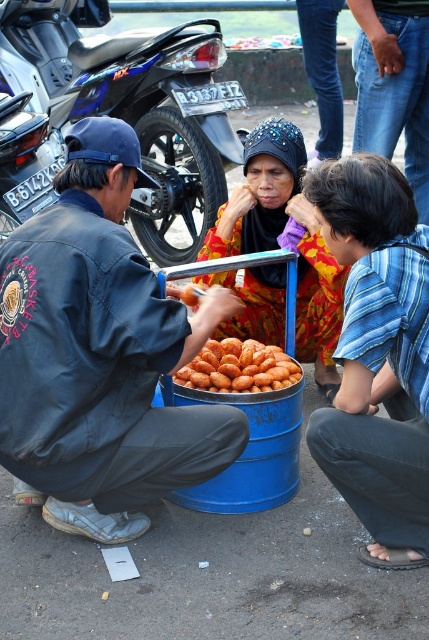
You are a street vendor trying to arrange items in your blue barrel. You have a blue striped shirt at lower right and a golden fried snack at center. Which item takes up more space horizontally?

The golden fried snack at center takes up more horizontal space since its width is greater than the blue striped shirt at lower right.

You are a customer at the street stall and want to order snacks. Which person should you approach first, the matte black jacket at left or the blue striped shirt at lower right, based on their positions?

You should approach the matte black jacket at left first because they are positioned to the left of the blue striped shirt at lower right, which is closer to you as you face the stall.

You are a customer wanting to order snacks from the blue barrel. You see the matte black jacket at left and the blue striped shirt at lower right. Which server should you approach for assistance?

You should approach the matte black jacket at left because the blue striped shirt at lower right is behind them, making the matte black jacket at left more accessible.